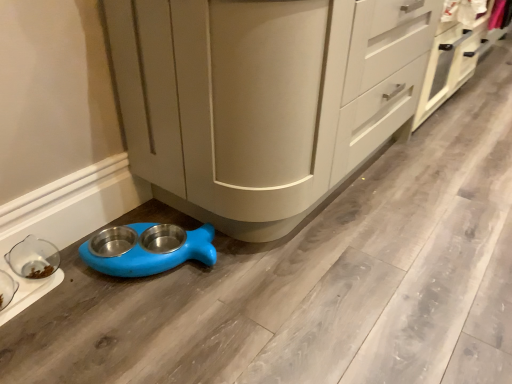
Find the location of a particular element. The image size is (512, 384). vacant space to the right of blue plastic pet feeder at lower left, which is the 2th appliance from left to right is located at coordinates (242, 267).